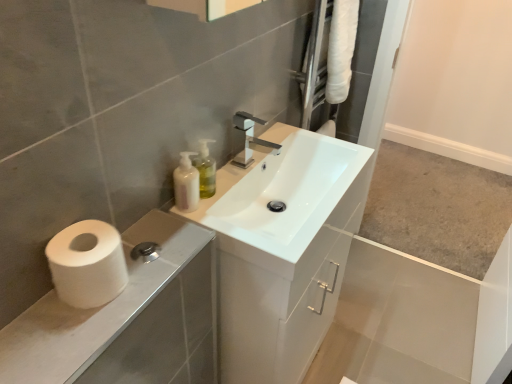
Locate an element on the screen. free space above white glossy cabinet at lower left (from a real-world perspective) is located at coordinates (110, 290).